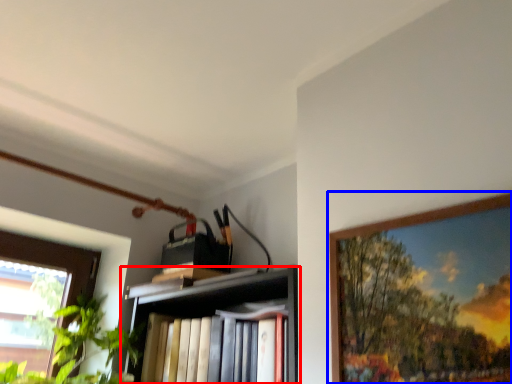
Question: Which object appears closest to the camera in this image, shelf (highlighted by a red box) or picture frame (highlighted by a blue box)?

Choices:
 (A) shelf
 (B) picture frame

Answer: (B)